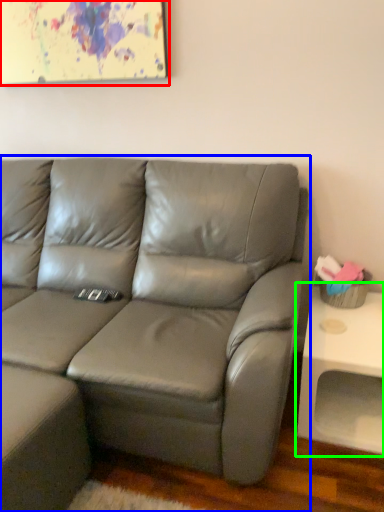
Question: Which is nearer to the picture frame (highlighted by a red box)? studio couch (highlighted by a blue box) or table (highlighted by a green box).

Choices:
 (A) studio couch
 (B) table

Answer: (A)